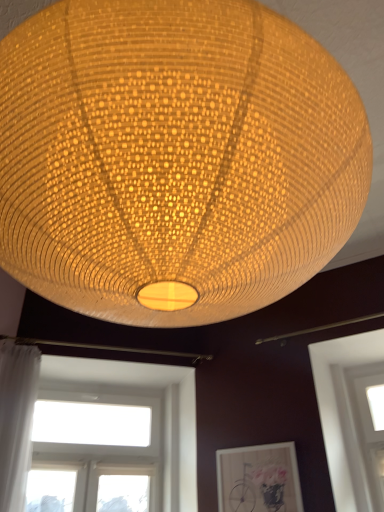
Question: From a real-world perspective, is matte wooden picture frame at lower center positioned under white sheer curtain at left based on gravity?

Choices:
 (A) yes
 (B) no

Answer: (A)

Question: Is matte wooden picture frame at lower center further to camera compared to white sheer curtain at left?

Choices:
 (A) no
 (B) yes

Answer: (B)

Question: Is matte wooden picture frame at lower center closer to the viewer compared to white sheer curtain at left?

Choices:
 (A) no
 (B) yes

Answer: (A)

Question: Could you tell me if matte wooden picture frame at lower center is facing white sheer curtain at left?

Choices:
 (A) no
 (B) yes

Answer: (A)

Question: Does matte wooden picture frame at lower center have a greater width compared to white sheer curtain at left?

Choices:
 (A) no
 (B) yes

Answer: (A)

Question: From a real-world perspective, does matte wooden picture frame at lower center stand above white sheer curtain at left?

Choices:
 (A) no
 (B) yes

Answer: (A)

Question: Considering the relative sizes of transparent glass window at lower right, the first window from the right, and white glass window at lower left, marked as the first window in a left-to-right arrangement, in the image provided, is transparent glass window at lower right, the first window from the right, shorter than white glass window at lower left, marked as the first window in a left-to-right arrangement,?

Choices:
 (A) no
 (B) yes

Answer: (A)

Question: Is transparent glass window at lower right, the second window positioned from the left, facing towards white glass window at lower left, marked as the second window in a right-to-left arrangement?

Choices:
 (A) no
 (B) yes

Answer: (A)

Question: From a real-world perspective, does transparent glass window at lower right, the first window from the right, stand above white glass window at lower left, marked as the second window in a right-to-left arrangement?

Choices:
 (A) no
 (B) yes

Answer: (A)

Question: Is white glass window at lower left, marked as the second window in a right-to-left arrangement, surrounded by transparent glass window at lower right, the second window positioned from the left?

Choices:
 (A) no
 (B) yes

Answer: (A)

Question: Is transparent glass window at lower right, the second window positioned from the left, not near white glass window at lower left, marked as the second window in a right-to-left arrangement?

Choices:
 (A) no
 (B) yes

Answer: (B)

Question: Would you say transparent glass window at lower right, the first window from the right, is outside white glass window at lower left, marked as the first window in a left-to-right arrangement?

Choices:
 (A) no
 (B) yes

Answer: (B)

Question: Is matte woven lampshade at center in front of matte wooden picture frame at lower center?

Choices:
 (A) yes
 (B) no

Answer: (A)